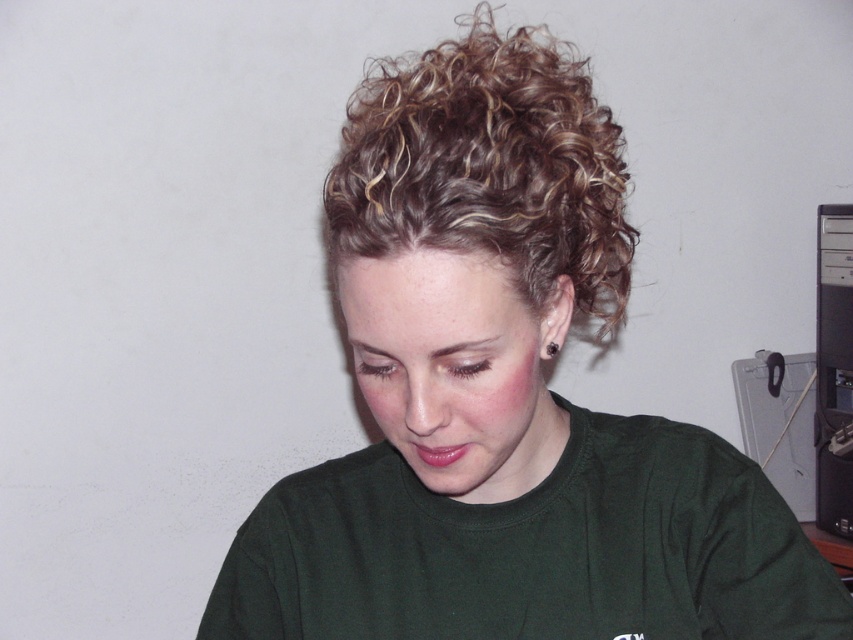
You are an interior designer assessing the layout of a home office. You see the curly blonde hair at upper center and the black plastic computer tower at right. Which object is positioned closer to the left side of the frame?

The curly blonde hair at upper center is positioned closer to the left side of the frame since it is to the left of the black plastic computer tower at right.

You are a photographer setting up a shoot in this room. You need to position a light source so that it illuminates the curly blonde hair at upper center without casting a shadow from the black plastic computer tower at right onto the subject. Where should you place the light source relative to the subject?

The curly blonde hair at upper center is located above the black plastic computer tower at right. To avoid casting a shadow from the computer tower onto the subject, the light source should be placed above the subject, positioned so that it shines downward onto the hair while the computer tower is below and out of the light path.

You are a photographer setting up for a portrait. You have a camera that requires a minimum distance of 18 inches to focus properly. The subject has curly blonde hair at upper center. Can you focus on the subject from your current position?

The curly blonde hair at upper center and camera are 18.42 inches apart from each other, which is just over the minimum required distance of 18 inches. Therefore, the camera can focus on the subject from the current position.